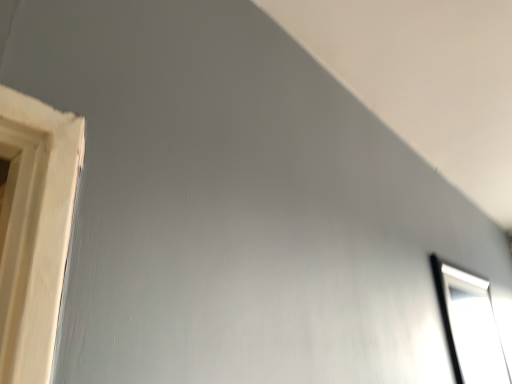
This screenshot has width=512, height=384. I want to click on black glass window at upper right, so [x=470, y=325].

What is the approximate height of black glass window at upper right?

Answer: black glass window at upper right is 18.16 inches tall.

What do you see at coordinates (470, 325) in the screenshot? I see `black glass window at upper right` at bounding box center [470, 325].

The height and width of the screenshot is (384, 512). Identify the location of black glass window at upper right. (470, 325).